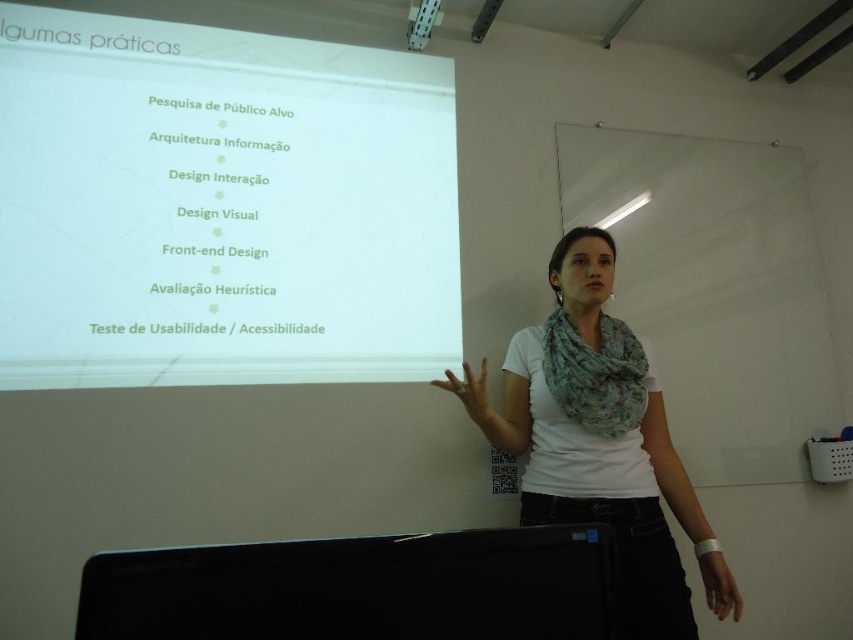
Which of these two, white fabric scarf at center or metallic projector at upper center, stands taller?

Standing taller between the two is white fabric scarf at center.

In the scene shown: Can you confirm if white fabric scarf at center is thinner than metallic projector at upper center?

No, white fabric scarf at center is not thinner than metallic projector at upper center.

Is point (647, 545) less distant than point (419, 33)?

Yes, it is.

Locate an element on the screen. Image resolution: width=853 pixels, height=640 pixels. white fabric scarf at center is located at coordinates (601, 442).

Who is lower down, white matte projector screen at upper left or metallic projector at upper center?

Positioned lower is white matte projector screen at upper left.

How much distance is there between white matte projector screen at upper left and metallic projector at upper center?

white matte projector screen at upper left is 73.00 centimeters away from metallic projector at upper center.

Is point (24, 32) farther from camera compared to point (410, 36)?

No, (24, 32) is closer to viewer.

Where is `white matte projector screen at upper left`? The height and width of the screenshot is (640, 853). white matte projector screen at upper left is located at coordinates (219, 205).

Can you confirm if white matte projector screen at upper left is positioned above black glossy monitor at lower center?

Correct, white matte projector screen at upper left is located above black glossy monitor at lower center.

Is white matte projector screen at upper left below black glossy monitor at lower center?

Actually, white matte projector screen at upper left is above black glossy monitor at lower center.

Locate an element on the screen. The image size is (853, 640). white matte projector screen at upper left is located at coordinates (219, 205).

Identify the location of white matte projector screen at upper left. (219, 205).